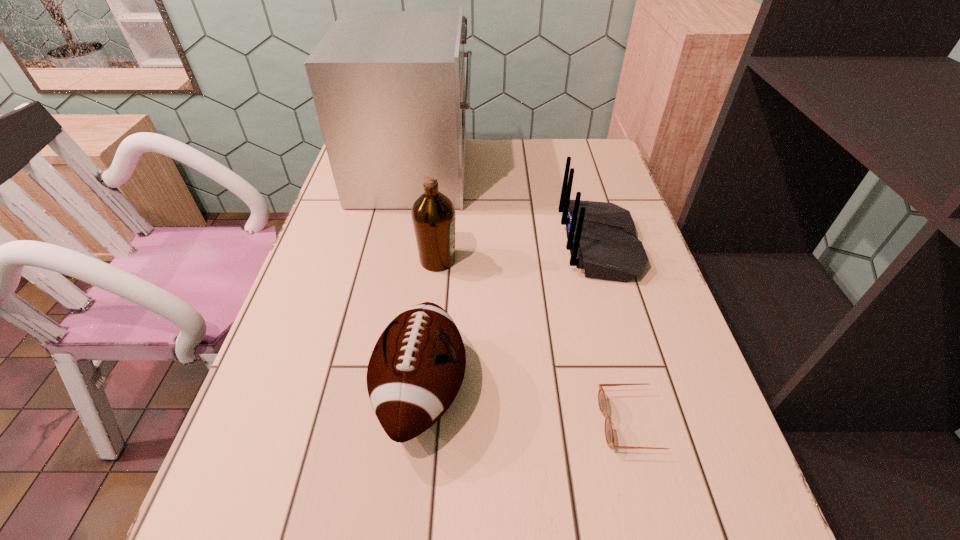
Identify the location of free space located on the back of the router. (542, 245).

Identify the location of vacant space situated 0.230m on the left of the football (American). The width and height of the screenshot is (960, 540). (255, 390).

You are a GUI agent. You are given a task and a screenshot of the screen. Output one action in this format:
    pyautogui.click(x=<x>, y=<y>)
    Task: Click on the vacant space positioned 0.290m on the front-facing side of the shortest object
    The height and width of the screenshot is (540, 960).
    Given the screenshot: What is the action you would take?
    pyautogui.click(x=441, y=422)

Where is `vacant space located on the front-facing side of the shortest object`? The image size is (960, 540). vacant space located on the front-facing side of the shortest object is located at coordinates (535, 422).

Where is `vacant region located 0.050m on the front-facing side of the shortest object`? vacant region located 0.050m on the front-facing side of the shortest object is located at coordinates (574, 422).

Where is `object situated at the far edge`? The width and height of the screenshot is (960, 540). object situated at the far edge is located at coordinates (389, 89).

I want to click on object located in the left edge section of the desktop, so click(x=389, y=89).

Find the location of a particular element. This screenshot has width=960, height=540. router that is at the right edge is located at coordinates (601, 236).

The width and height of the screenshot is (960, 540). Find the location of `sunglasses positioned at the right edge`. sunglasses positioned at the right edge is located at coordinates (609, 435).

Where is `object located in the far left corner section of the desktop`? object located in the far left corner section of the desktop is located at coordinates pos(389,89).